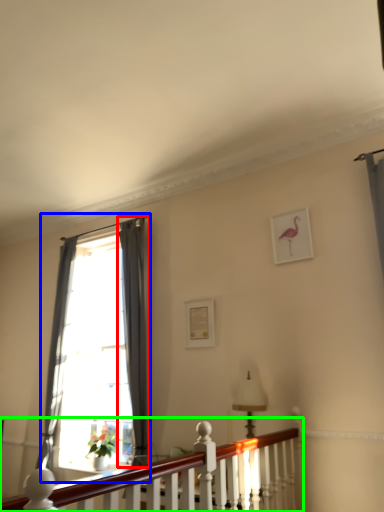
Question: Which object is the farthest from curtain (highlighted by a red box)? Choose among these: window (highlighted by a blue box) or balustrade (highlighted by a green box).

Choices:
 (A) window
 (B) balustrade

Answer: (B)